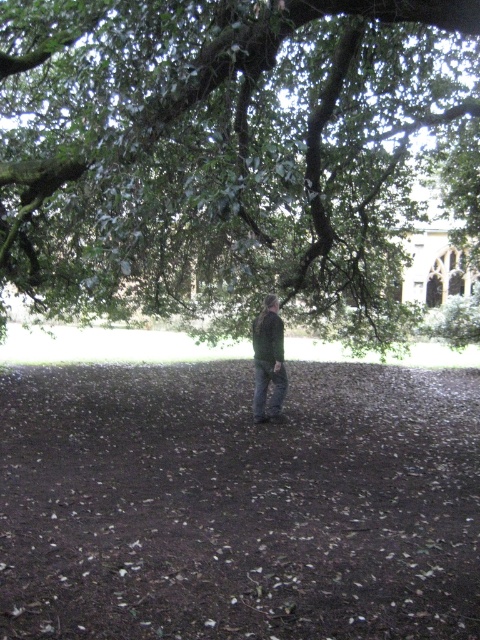
Question: Does brown soil at center appear on the left side of green matte jacket at center?

Choices:
 (A) yes
 (B) no

Answer: (A)

Question: Which point appears farthest from the camera in this image?

Choices:
 (A) (277, 317)
 (B) (12, 35)
 (C) (419, 557)

Answer: (B)

Question: Is green leafy tree at upper center positioned before green matte jacket at center?

Choices:
 (A) no
 (B) yes

Answer: (B)

Question: Among these objects, which one is nearest to the camera?

Choices:
 (A) brown soil at center
 (B) green leafy tree at upper center
 (C) green matte jacket at center

Answer: (A)

Question: Which of the following is the closest to the observer?

Choices:
 (A) (417, 564)
 (B) (141, 92)

Answer: (A)

Question: Is green leafy tree at upper center below brown soil at center?

Choices:
 (A) yes
 (B) no

Answer: (B)